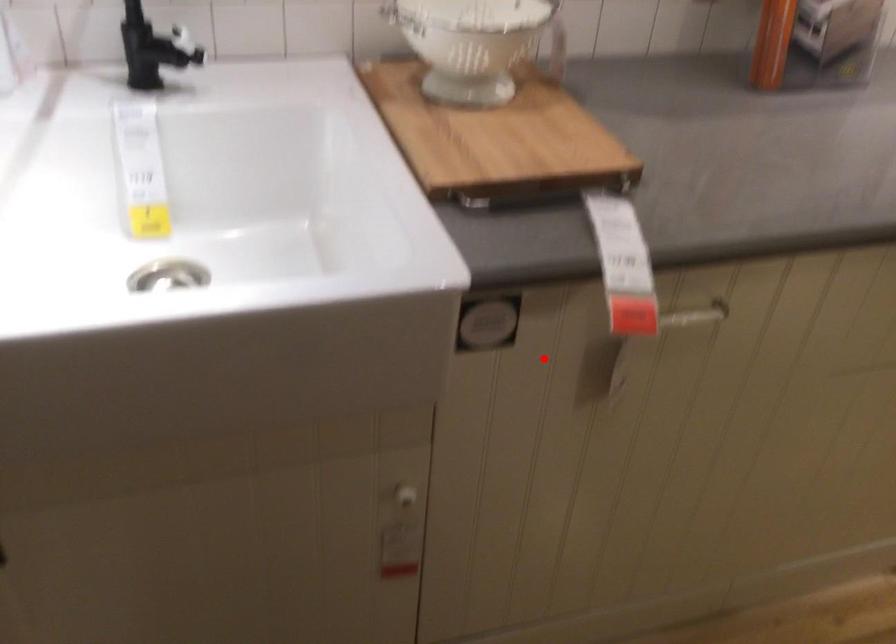
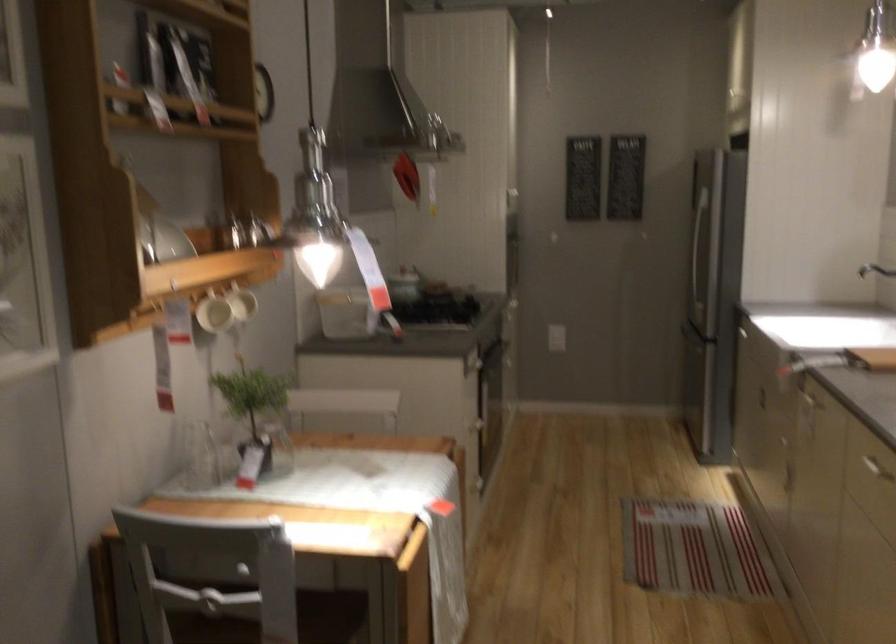
Question: I am providing you with two images of the same scene from different viewpoints. In image1, a red point is highlighted. Considering the same 3D point in image2, which of the following is correct?

Choices:
 (A) It is closer
 (B) It is farther

Answer: (B)